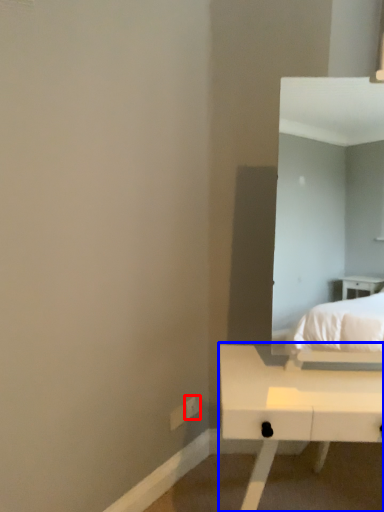
Question: Which object is further to the camera taking this photo, electric outlet (highlighted by a red box) or table (highlighted by a blue box)?

Choices:
 (A) electric outlet
 (B) table

Answer: (A)